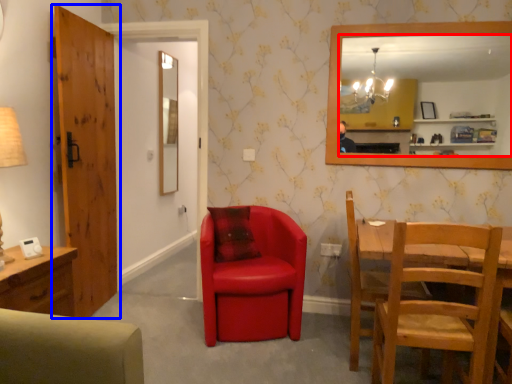
Question: Which point is further to the camera, mirror (highlighted by a red box) or door (highlighted by a blue box)?

Choices:
 (A) mirror
 (B) door

Answer: (A)